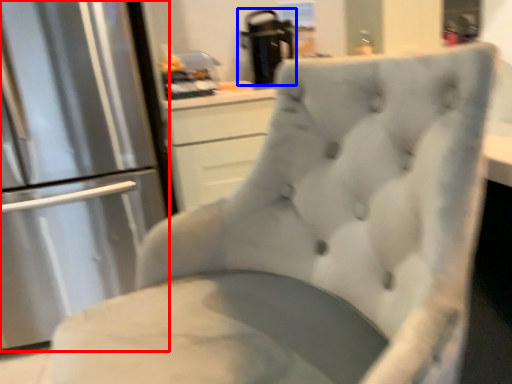
Question: Which of the following is the farthest to the observer, refrigerator (highlighted by a red box) or appliance (highlighted by a blue box)?

Choices:
 (A) refrigerator
 (B) appliance

Answer: (B)